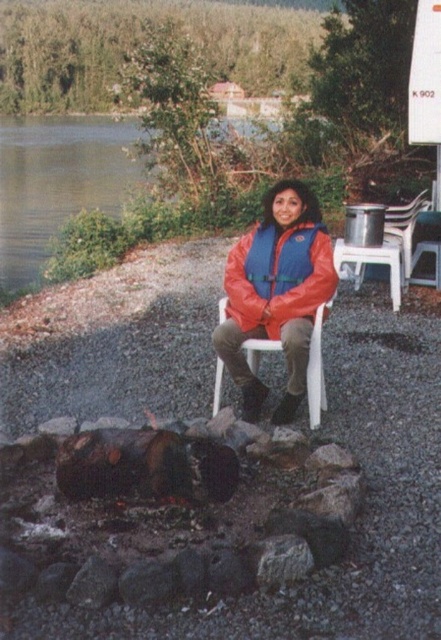
At what (x,y) coordinates should I click in order to perform the action: click on green grass at upper center. Please return your answer as a coordinate pair (x, y). Looking at the image, I should click on (58, 180).

Can you confirm if green grass at upper center is taller than orange nylon jacket at center?

Yes, green grass at upper center is taller than orange nylon jacket at center.

In the scene shown: Who is more forward, (68, 138) or (310, 298)?

Positioned in front is point (310, 298).

Identify the location of green grass at upper center. This screenshot has height=640, width=441. (58, 180).

Is point (242, 241) positioned behind point (41, 188)?

No, it is in front of (41, 188).

Which is in front, point (224, 320) or point (129, 180)?

Point (224, 320) is more forward.

The width and height of the screenshot is (441, 640). Find the location of `matte orange life vest at center`. matte orange life vest at center is located at coordinates (276, 292).

Between matte orange life vest at center and orange nylon jacket at center, which one has less height?

orange nylon jacket at center

Based on the photo, between matte orange life vest at center and orange nylon jacket at center, which one has more height?

matte orange life vest at center

Is point (254, 273) positioned behind point (243, 321)?

Yes, point (254, 273) is behind point (243, 321).

What are the coordinates of `matte orange life vest at center` in the screenshot? It's located at (276, 292).